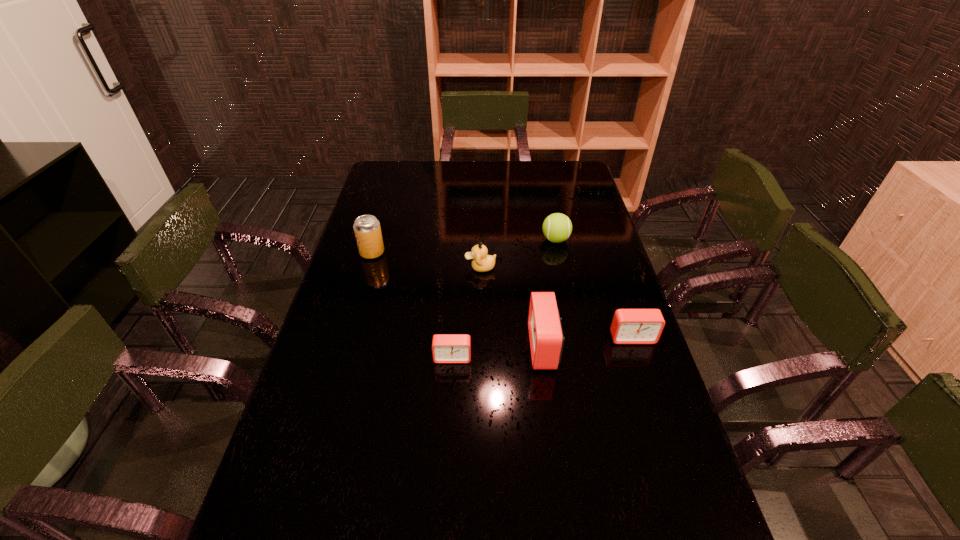
Where is `alarm clock positioned at the right edge`? Image resolution: width=960 pixels, height=540 pixels. alarm clock positioned at the right edge is located at coordinates (629, 326).

Identify the location of tennis ball present at the right edge. This screenshot has height=540, width=960. (557, 227).

In the image, there is a desktop. Identify the location of vacant space at the far edge. (536, 162).

In the image, there is a desktop. Identify the location of vacant region at the near edge. This screenshot has width=960, height=540. (607, 507).

You are a GUI agent. You are given a task and a screenshot of the screen. Output one action in this format:
    pyautogui.click(x=<x>, y=<y>)
    Task: Click on the free space at the left edge of the desktop
    This screenshot has width=960, height=540.
    Given the screenshot: What is the action you would take?
    pyautogui.click(x=335, y=394)

In the image, there is a desktop. Where is `vacant space at the right edge`? vacant space at the right edge is located at coordinates (580, 255).

Identify the location of free area in between the duckling and the second shortest alarm clock. This screenshot has height=540, width=960. (556, 302).

Locate an element on the screen. Image resolution: width=960 pixels, height=540 pixels. free area in between the leftmost alarm clock and the pop (soda) is located at coordinates (412, 305).

Where is `free point between the tallest alarm clock and the second shortest alarm clock`? Image resolution: width=960 pixels, height=540 pixels. free point between the tallest alarm clock and the second shortest alarm clock is located at coordinates point(588,342).

Identify the location of free spot between the tennis ball and the leftmost alarm clock. (504, 299).